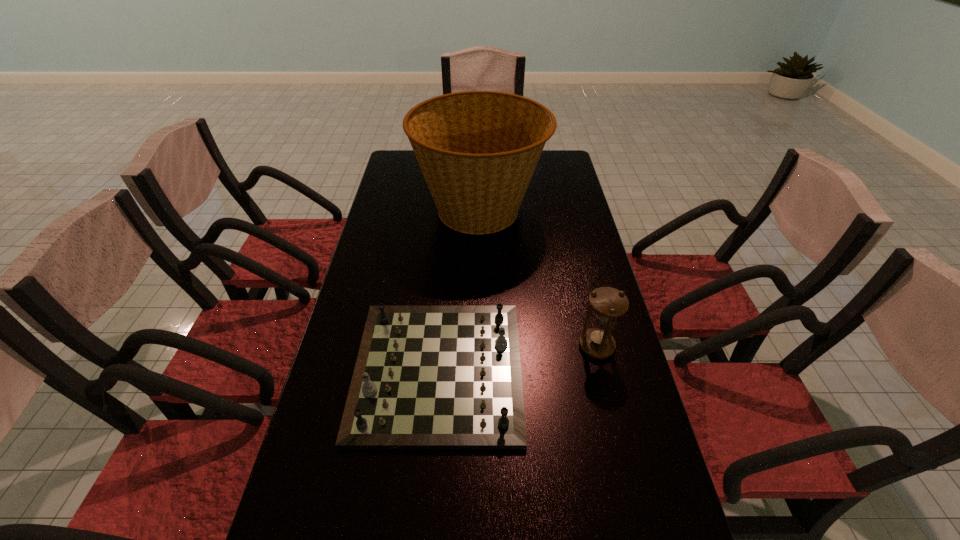
Where is `chessboard located at the left edge`? The image size is (960, 540). chessboard located at the left edge is located at coordinates (426, 377).

Locate an element on the screen. This screenshot has height=540, width=960. basket that is at the right edge is located at coordinates (477, 150).

Locate an element on the screen. The image size is (960, 540). hourglass located at the right edge is located at coordinates (608, 303).

Where is `object at the far left corner`? The image size is (960, 540). object at the far left corner is located at coordinates pyautogui.click(x=477, y=150).

Where is `object that is at the far right corner`? This screenshot has width=960, height=540. object that is at the far right corner is located at coordinates (477, 150).

Locate an element on the screen. The width and height of the screenshot is (960, 540). free space at the left edge of the desktop is located at coordinates (375, 212).

Identify the location of vacant space at the right edge of the desktop. (603, 273).

You are a GUI agent. You are given a task and a screenshot of the screen. Output one action in this format:
    pyautogui.click(x=<x>, y=<y>)
    Task: Click on the vacant space at the far right corner of the desktop
    
    Given the screenshot: What is the action you would take?
    pyautogui.click(x=571, y=172)

Locate an element on the screen. free space that is in between the tallest object and the chessboard is located at coordinates (459, 290).

Locate an element on the screen. The height and width of the screenshot is (540, 960). free area in between the farthest object and the chessboard is located at coordinates (459, 290).